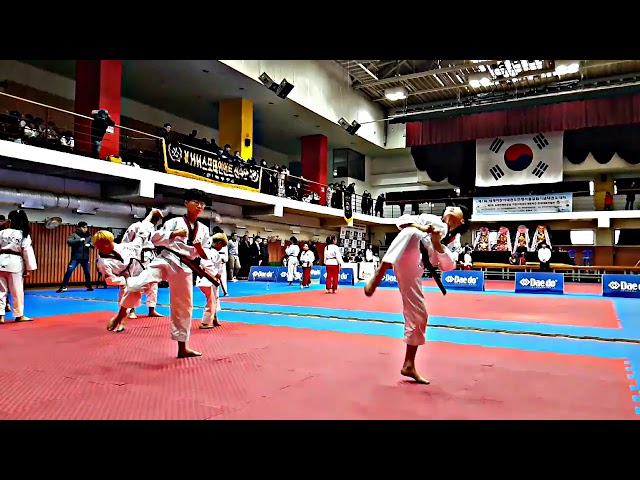
At what (x,y) coordinates should I click in order to perform the action: click on ceiling area. Please return your answer as a coordinate pair (x, y). This screenshot has width=640, height=480. Looking at the image, I should click on (406, 71), (594, 64).